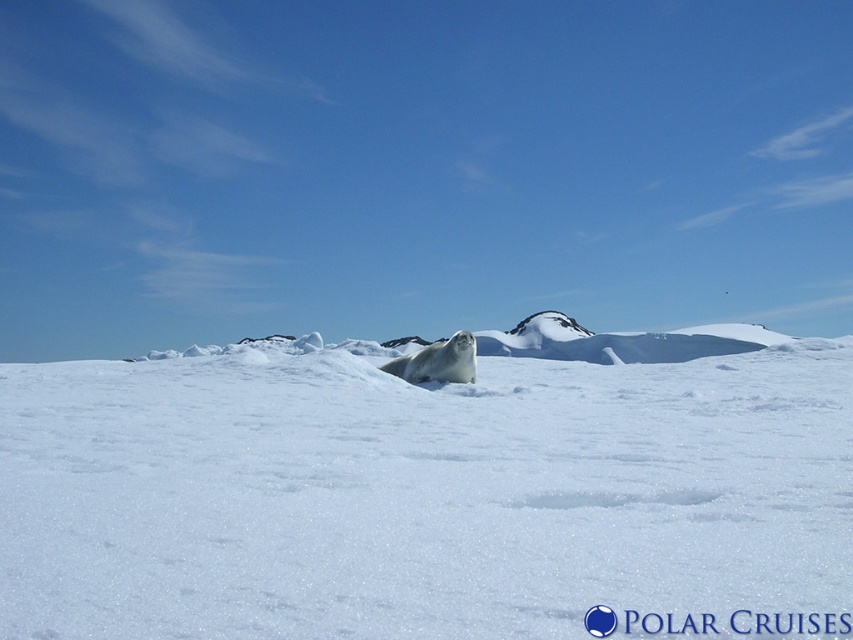
Can you confirm if white fluffy snow at center is thinner than white fur seal at center?

No, white fluffy snow at center is not thinner than white fur seal at center.

Between point (450, 548) and point (427, 365), which one is positioned in front?

Positioned in front is point (450, 548).

At what (x,y) coordinates should I click in order to perform the action: click on white fluffy snow at center. Please return your answer as a coordinate pair (x, y). Looking at the image, I should click on (421, 493).